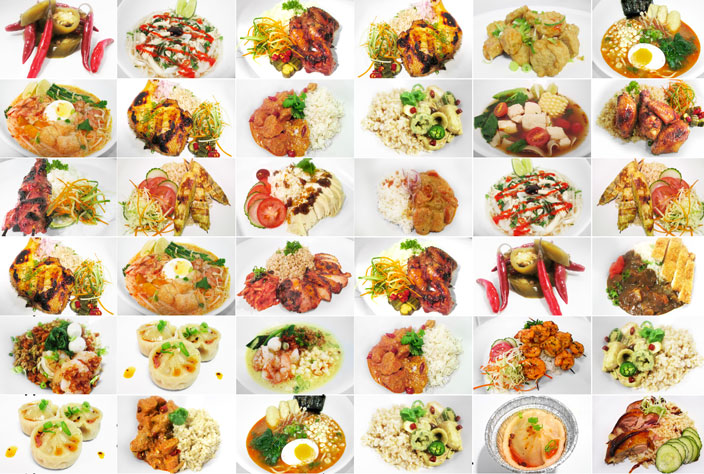
Identify the location of 7 slices of chicken on plate. (301, 218), (308, 217), (320, 210), (326, 206), (332, 201), (334, 191), (329, 180).